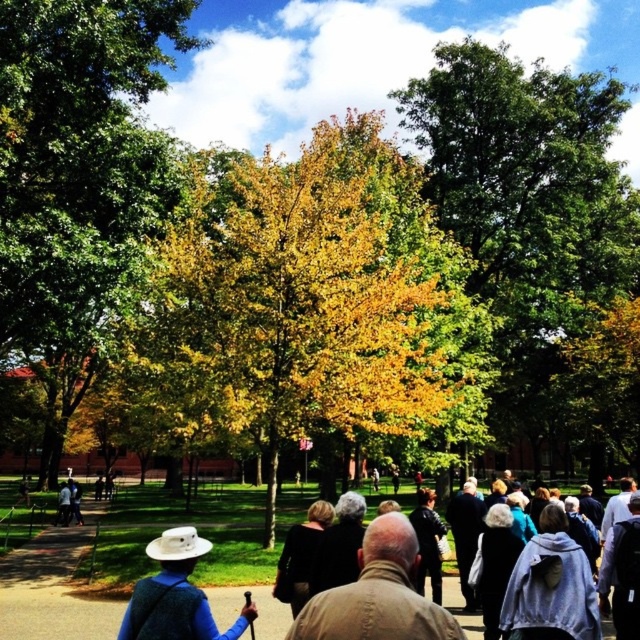
Is green leafy tree at center in front of brown paved path at center?

No, green leafy tree at center is behind brown paved path at center.

The height and width of the screenshot is (640, 640). Identify the location of green leafy tree at center. (536, 230).

Who is more distant from viewer, (420, 97) or (68, 612)?

Point (420, 97)

Where is `green leafy tree at center`? This screenshot has height=640, width=640. green leafy tree at center is located at coordinates (536, 230).

Is point (554, 227) positioned behind point (378, 624)?

Yes, point (554, 227) is behind point (378, 624).

The image size is (640, 640). What are the coordinates of `green leafy tree at center` in the screenshot? It's located at (536, 230).

Between blue fabric backpack at center and black matte jacket at center, which one has more height?

black matte jacket at center is taller.

Between point (188, 628) and point (292, 608), which one is positioned in front?

Positioned in front is point (188, 628).

I want to click on blue fabric backpack at center, so click(x=176, y=595).